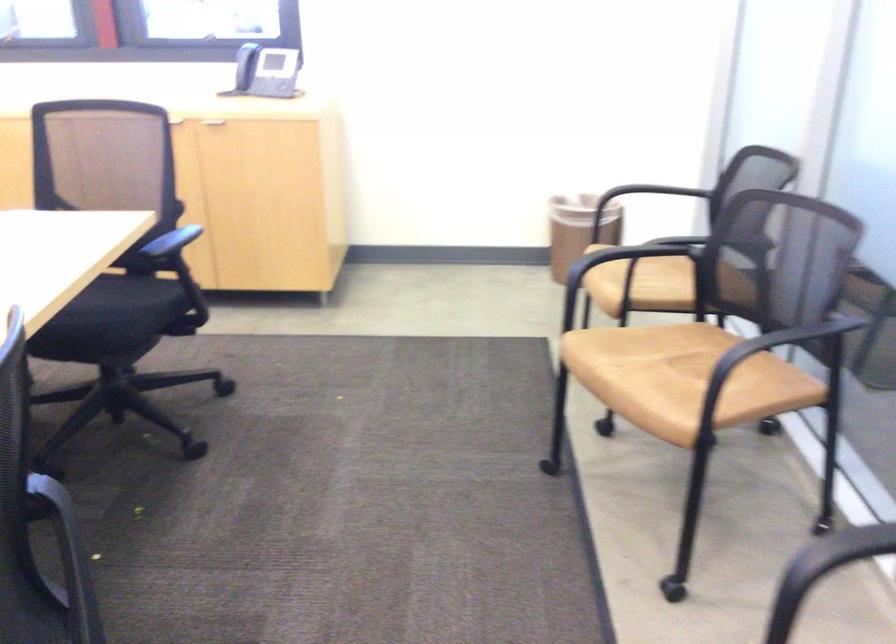
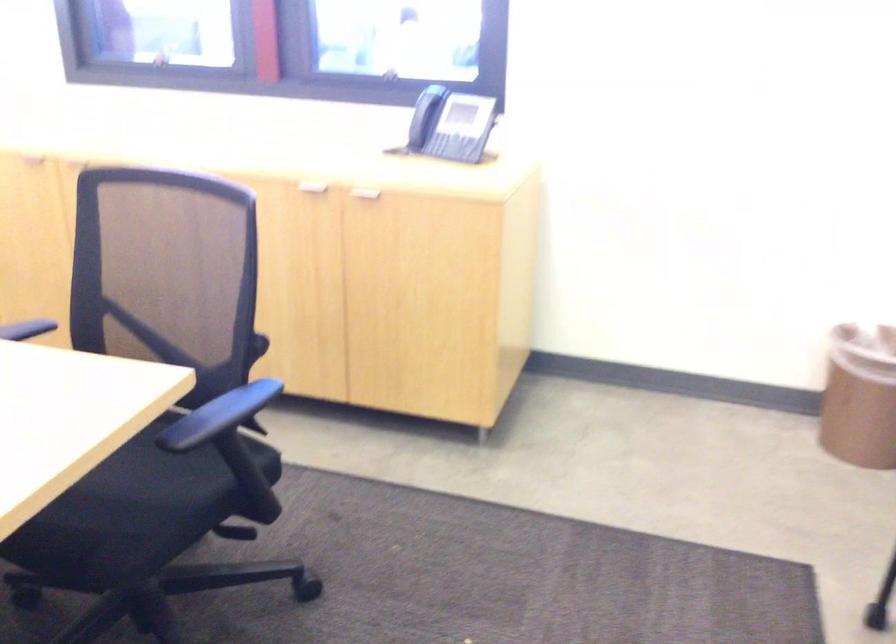
The point at (x=566, y=236) is marked in the first image. Where is the corresponding point in the second image?

(859, 395)